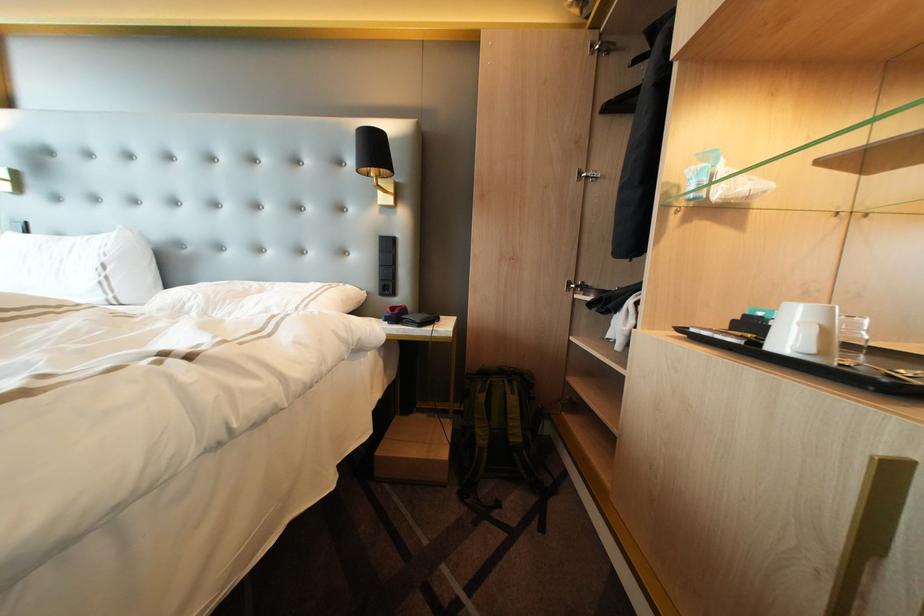
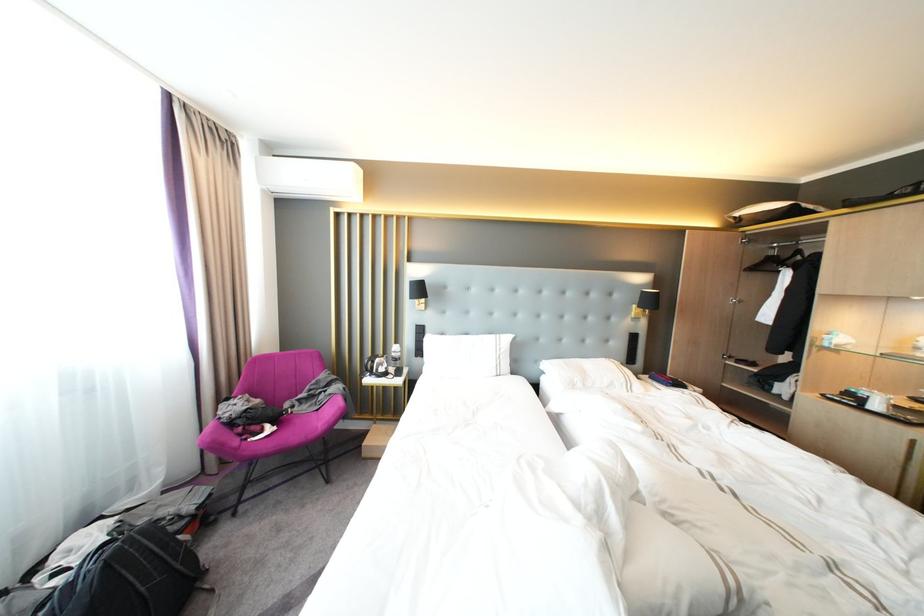
Question: I am providing you with two images of the same scene from different viewpoints. Which of the following objects are not visible in image2?

Choices:
 (A) white pillow
 (B) black clothes hanger
 (C) green soap bar
 (D) green backpack

Answer: (D)